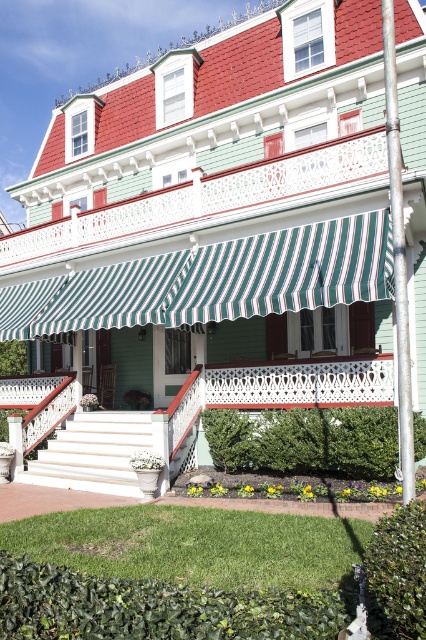
Question: Where is green striped awning at center located in relation to white painted wood porch at center in the image?

Choices:
 (A) above
 (B) below

Answer: (A)

Question: Is green striped awning at center further to the viewer compared to white painted wood porch at center?

Choices:
 (A) no
 (B) yes

Answer: (A)

Question: Which object appears closest to the camera in this image?

Choices:
 (A) white painted wood porch at center
 (B) green striped awning at center

Answer: (B)

Question: Does green striped awning at center have a larger size compared to white painted wood porch at center?

Choices:
 (A) yes
 (B) no

Answer: (A)

Question: Which point appears farthest from the camera in this image?

Choices:
 (A) (253, 259)
 (B) (181, 426)

Answer: (A)

Question: Which object is farther from the camera taking this photo?

Choices:
 (A) green striped awning at center
 (B) white painted wood porch at center

Answer: (B)